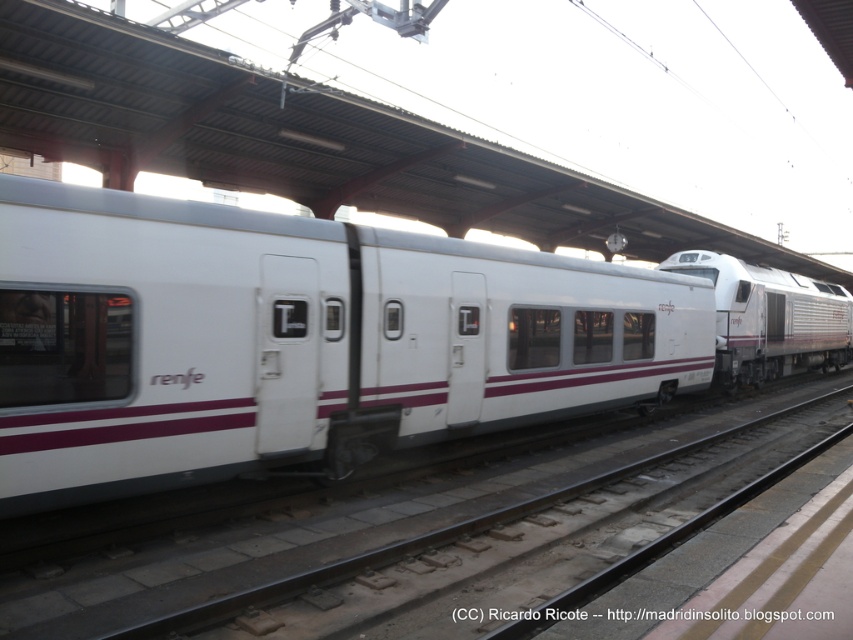
Can you confirm if white glossy train car at center is taller than white glossy train at center?

Incorrect, white glossy train car at center's height is not larger of white glossy train at center's.

Who is shorter, white glossy train car at center or white glossy train at center?

white glossy train car at center

What do you see at coordinates (294, 340) in the screenshot? I see `white glossy train car at center` at bounding box center [294, 340].

Where is `white glossy train car at center`? This screenshot has height=640, width=853. white glossy train car at center is located at coordinates (294, 340).

Between point (68, 531) and point (848, 294), which one is positioned behind?

Point (848, 294)

Does white metal track at center have a greater width compared to white glossy train at center?

In fact, white metal track at center might be narrower than white glossy train at center.

Which is behind, point (88, 557) or point (787, 304)?

Point (787, 304)

You are a GUI agent. You are given a task and a screenshot of the screen. Output one action in this format:
    pyautogui.click(x=<x>, y=<y>)
    Task: Click on the white metal track at center
    
    Given the screenshot: What is the action you would take?
    pyautogui.click(x=338, y=525)

In order to click on white glossy train car at center in this screenshot , I will do `click(294, 340)`.

How distant is white glossy train car at center from white metal track at center?

5.84 feet

Which is behind, point (70, 380) or point (326, 556)?

The point (326, 556) is behind.

The image size is (853, 640). In order to click on white glossy train car at center in this screenshot , I will do `click(294, 340)`.